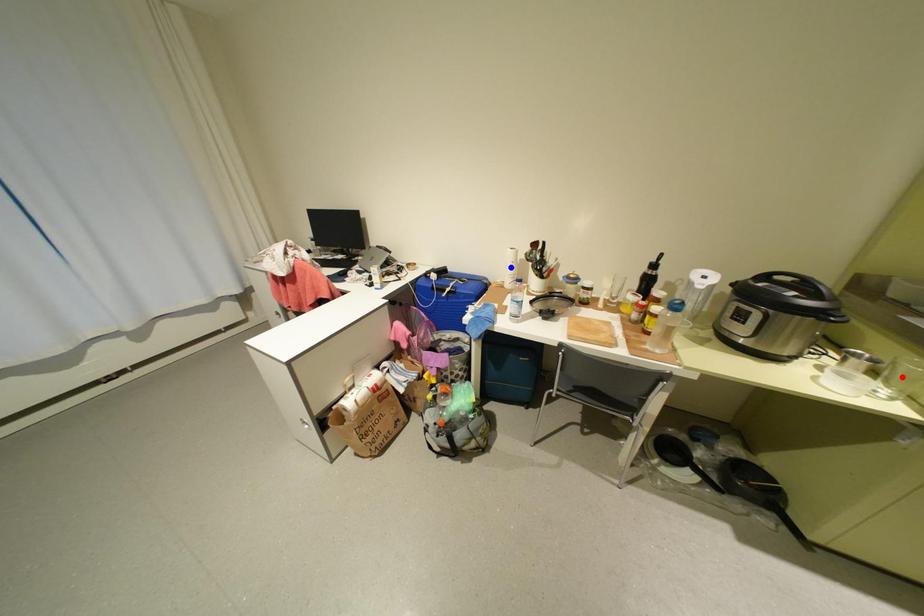
Question: Two points are marked on the image. Which point is closer to the camera?

Choices:
 (A) Blue point is closer.
 (B) Red point is closer.

Answer: (B)